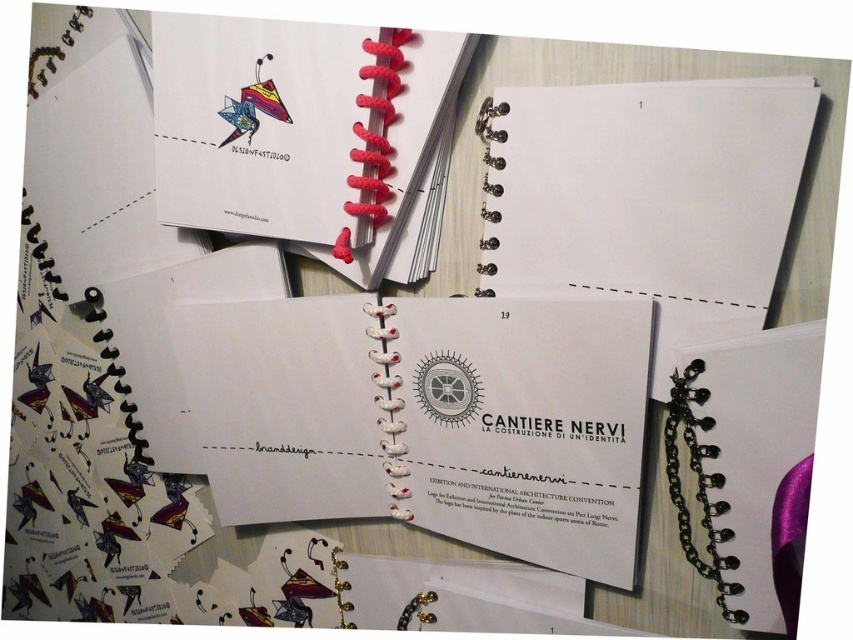
Question: Estimate the real-world distances between objects in this image. Which object is farther from the white paper notebook at center?

Choices:
 (A) white paper at center
 (B) black chain-link notebook at center
 (C) matte red spiral notebook at upper center

Answer: (B)

Question: Does white paper at center have a smaller size compared to black chain-link notebook at center?

Choices:
 (A) no
 (B) yes

Answer: (A)

Question: Based on their relative distances, which object is nearer to the matte red spiral notebook at upper center?

Choices:
 (A) black chain-link notebook at center
 (B) white paper notebook at center
 (C) white paper at center

Answer: (B)

Question: Does white paper notebook at center appear on the right side of white paper at center?

Choices:
 (A) no
 (B) yes

Answer: (A)

Question: Can you confirm if white paper notebook at center is wider than matte red spiral notebook at upper center?

Choices:
 (A) yes
 (B) no

Answer: (A)

Question: Which object is positioned farthest from the white paper notebook at center?

Choices:
 (A) matte red spiral notebook at upper center
 (B) black chain-link notebook at center

Answer: (B)